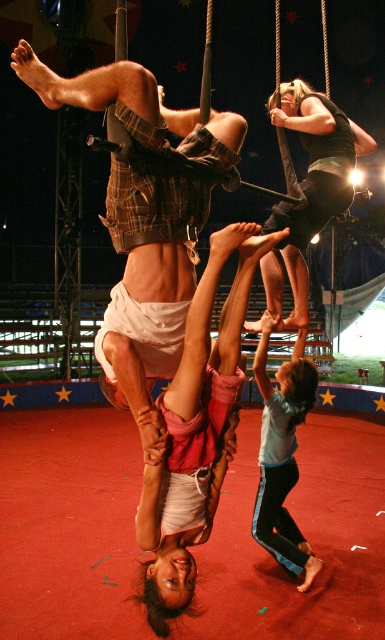
Question: Observing the image, what is the correct spatial positioning of light blue fabric pants at lower right in reference to black fabric swing at upper center?

Choices:
 (A) left
 (B) right

Answer: (A)

Question: Among these points, which one is nearest to the camera?

Choices:
 (A) (276, 77)
 (B) (291, 416)

Answer: (B)

Question: Does light blue fabric pants at lower right have a greater width compared to black fabric swing at upper center?

Choices:
 (A) no
 (B) yes

Answer: (A)

Question: Where is light blue fabric pants at lower right located in relation to black fabric swing at upper center in the image?

Choices:
 (A) left
 (B) right

Answer: (A)

Question: Which of the following is the farthest from the observer?

Choices:
 (A) light blue fabric pants at lower right
 (B) black fabric swing at upper center

Answer: (A)